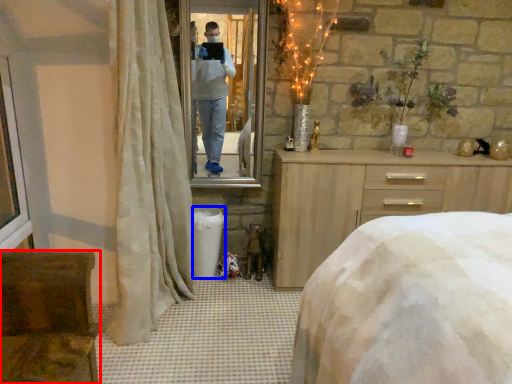
Question: Which object appears closest to the camera in this image, furniture (highlighted by a red box) or trash bin/can (highlighted by a blue box)?

Choices:
 (A) furniture
 (B) trash bin/can

Answer: (A)